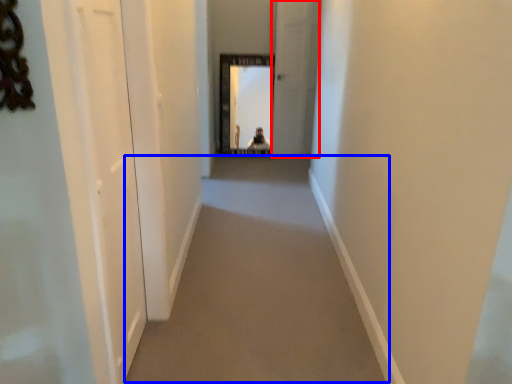
Question: Which point is further to the camera, screen door (highlighted by a red box) or corridor (highlighted by a blue box)?

Choices:
 (A) screen door
 (B) corridor

Answer: (A)